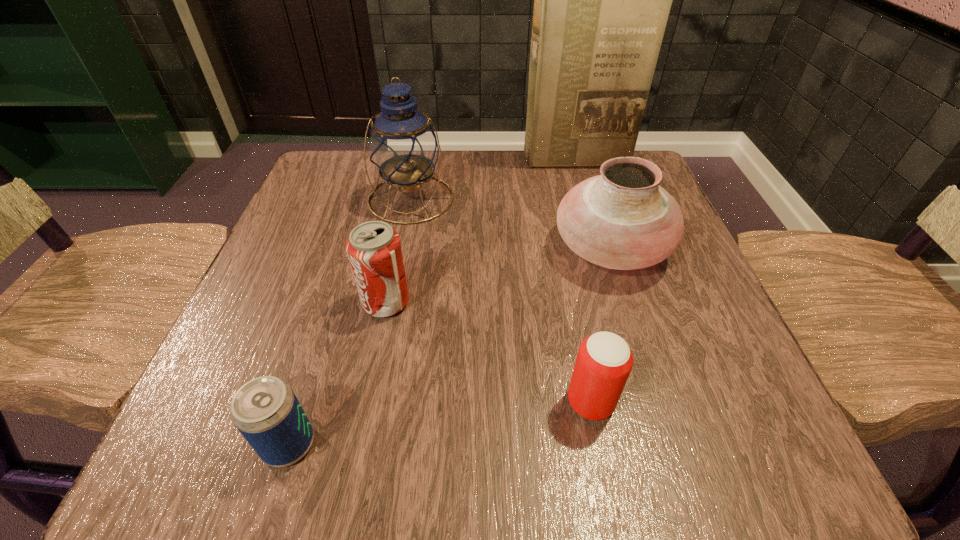
In order to click on vacant space that is in between the second tallest object and the left beer can in this screenshot , I will do `click(349, 321)`.

This screenshot has width=960, height=540. What are the coordinates of `unoccupied area between the left beer can and the right beer can` in the screenshot? It's located at (440, 423).

The image size is (960, 540). Identify the location of free point between the soda can and the pottery. (498, 275).

Find the location of `free space between the soda can and the left beer can`. free space between the soda can and the left beer can is located at coordinates click(x=338, y=373).

Identify the location of free space between the lantern and the pottery. The height and width of the screenshot is (540, 960). (511, 223).

Locate an element on the screen. The width and height of the screenshot is (960, 540). free spot between the pottery and the left beer can is located at coordinates (450, 346).

Find the location of a particular element. Image resolution: width=960 pixels, height=540 pixels. empty space that is in between the soda can and the pottery is located at coordinates (498, 275).

At what (x,y) coordinates should I click in order to perform the action: click on vacant point located between the soda can and the farthest object. Please return your answer as a coordinate pair (x, y). The height and width of the screenshot is (540, 960). Looking at the image, I should click on (480, 231).

Point out which object is positioned as the nearest to the right beer can. Please provide its 2D coordinates. Your answer should be formatted as a tuple, i.e. [(x, y)], where the tuple contains the x and y coordinates of a point satisfying the conditions above.

[(622, 219)]

Find the location of a particular element. This screenshot has height=540, width=960. object that can be found as the fifth closest to the soda can is located at coordinates (602, 0).